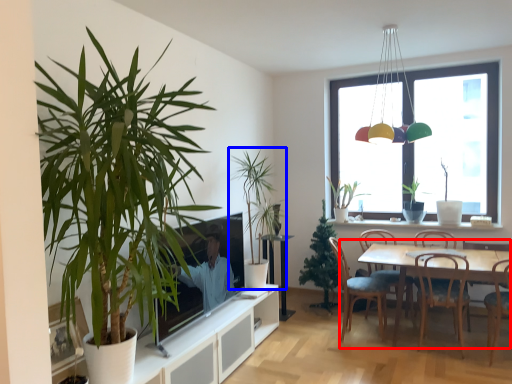
Question: Which of the following is the closest to the observer, kitchen & dining room table (highlighted by a red box) or houseplant (highlighted by a blue box)?

Choices:
 (A) kitchen & dining room table
 (B) houseplant

Answer: (A)